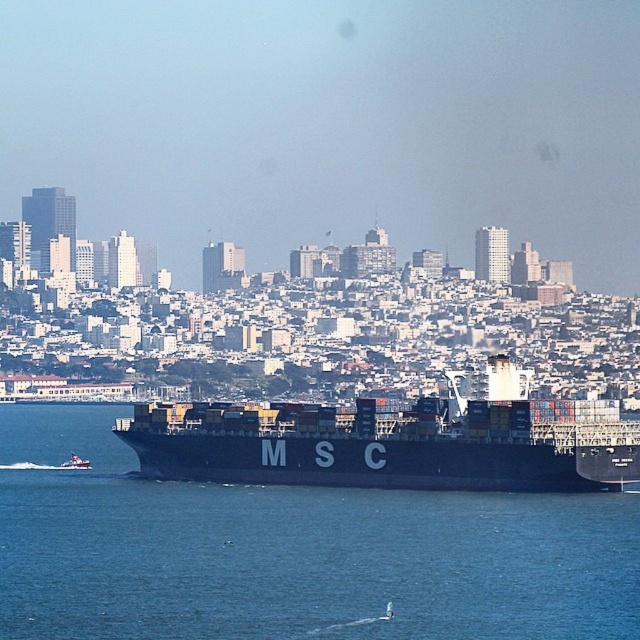
You are a photographer trying to capture the black matte cargo ship at center and the black matte water at center in the same frame. Based on their positions, which object should you adjust your camera to focus on first to ensure both are in the shot?

The black matte water at center is positioned on the left side of the black matte cargo ship at center. To capture both in the same frame, focus on the black matte water at center first since it is on the left, ensuring the cargo ship remains within the frame to the right.

You are a photographer planning to capture the black matte cargo ship at center and the black matte water at center in a single frame. Based on the scene, which object occupies more horizontal space in the image?

The black matte water at center has a greater width than the black matte cargo ship at center, so it occupies more horizontal space in the image.